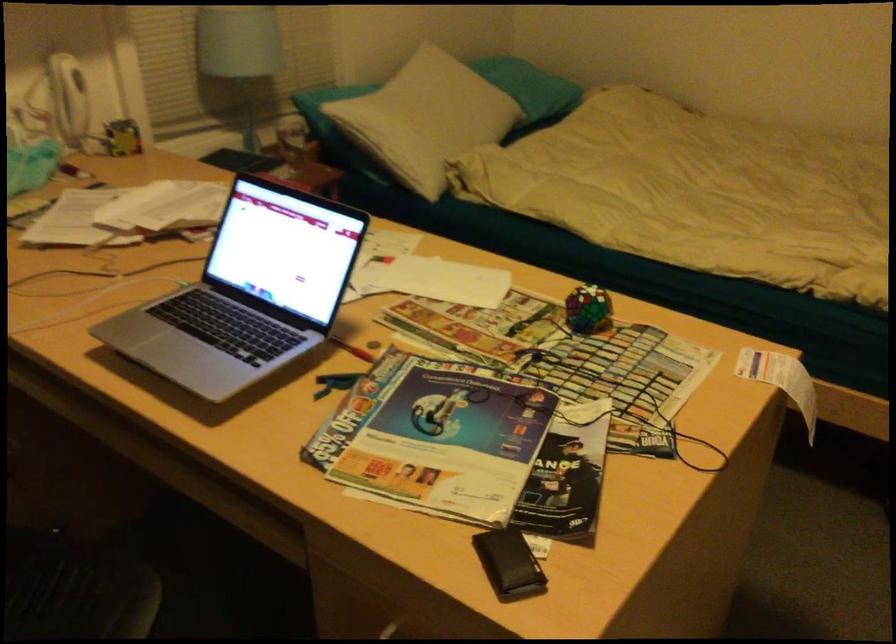
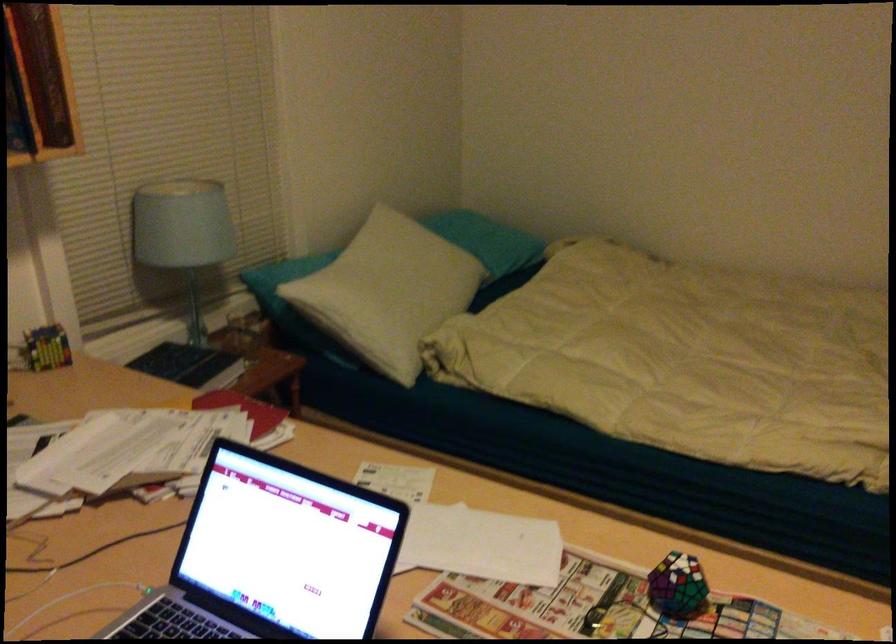
Where in the second image is the point corresponding to (590,308) from the first image?

(677, 585)